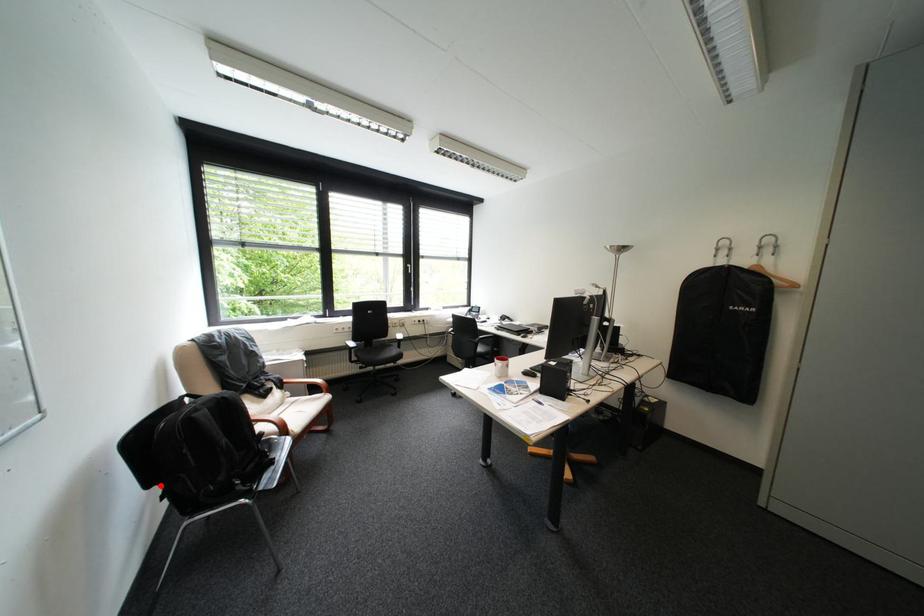
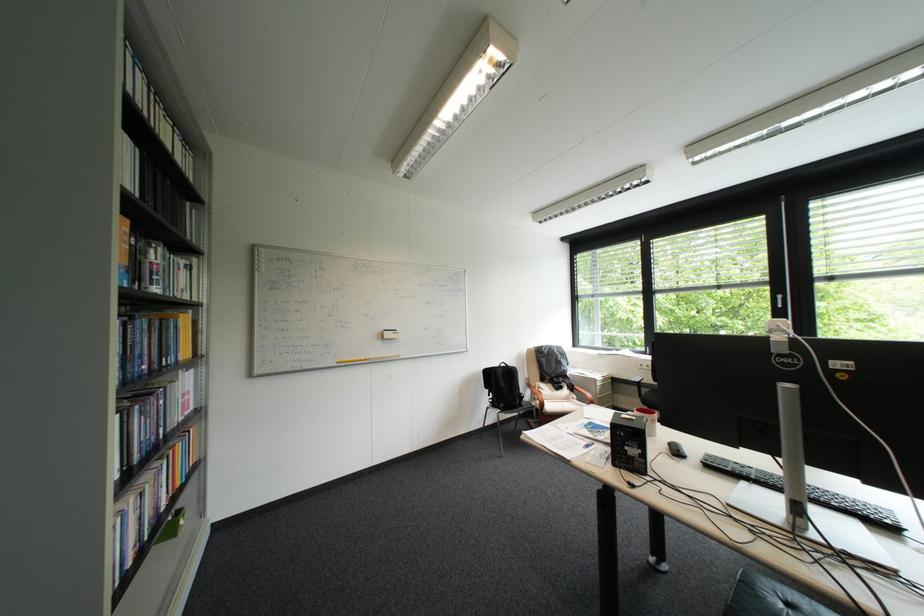
Question: I am providing you with two images of the same scene from different viewpoints. A red point is shown in image1. For the corresponding object point in image2, is it positioned nearer or farther from the camera?

Choices:
 (A) Nearer
 (B) Farther

Answer: (B)